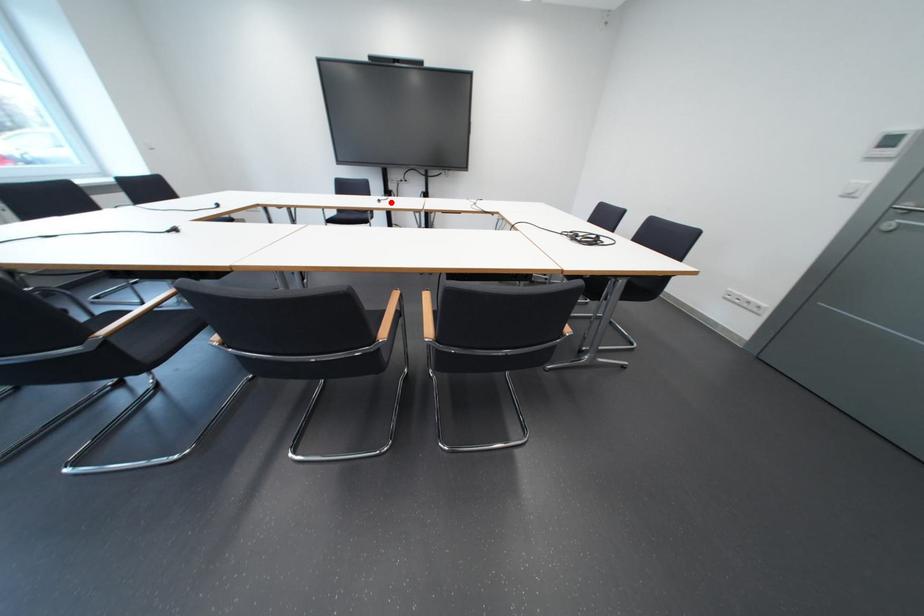
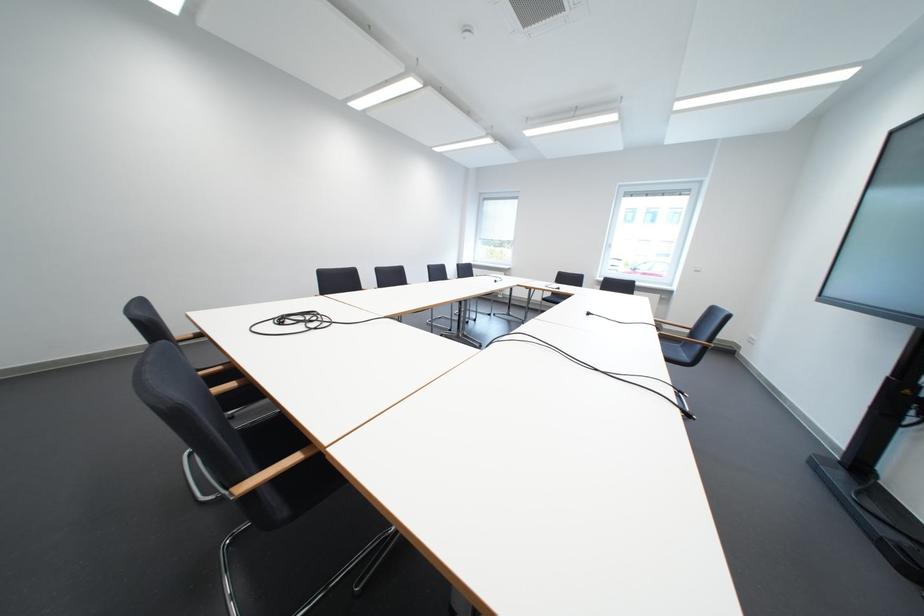
Question: I am providing you with two images of the same scene from different viewpoints. Given a red point in image1, look at the same physical point in image2. Is it:

Choices:
 (A) Closer to the viewpoint
 (B) Farther from the viewpoint

Answer: (B)